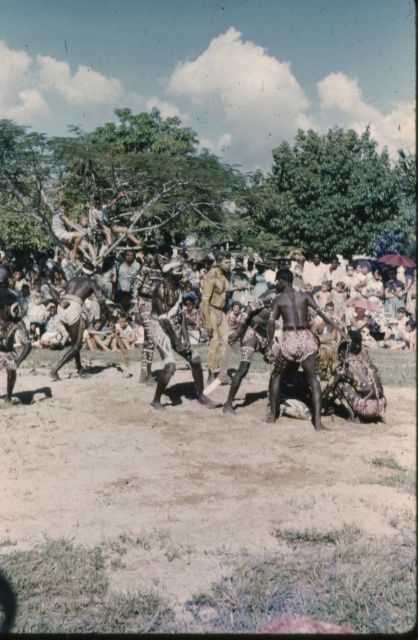
Is textured brown cloth at center to the left of camouflage fabric uniform at center from the viewer's perspective?

Yes, textured brown cloth at center is to the left of camouflage fabric uniform at center.

Who is positioned more to the left, textured brown cloth at center or camouflage fabric uniform at center?

textured brown cloth at center

Between point (71, 352) and point (221, 252), which one is positioned in front?

Point (71, 352) is in front.

Identify the location of textured brown cloth at center. (76, 314).

Is printed fabric shorts at center smaller than camouflage fabric uniform at center?

Indeed, printed fabric shorts at center has a smaller size compared to camouflage fabric uniform at center.

Between printed fabric shorts at center and camouflage fabric uniform at center, which one has less height?

printed fabric shorts at center

Who is more forward, [313,353] or [206,276]?

Point [313,353]

Where is `printed fabric shorts at center`? printed fabric shorts at center is located at coordinates (295, 340).

Does printed fabric shorts at center come in front of brown textured fabric at center?

Yes, it is.

Consider the image. Between printed fabric shorts at center and brown textured fabric at center, which one has more height?

brown textured fabric at center

Between point (305, 296) and point (173, 333), which one is positioned behind?

Point (173, 333)

Identify the location of printed fabric shorts at center. This screenshot has width=418, height=640. (295, 340).